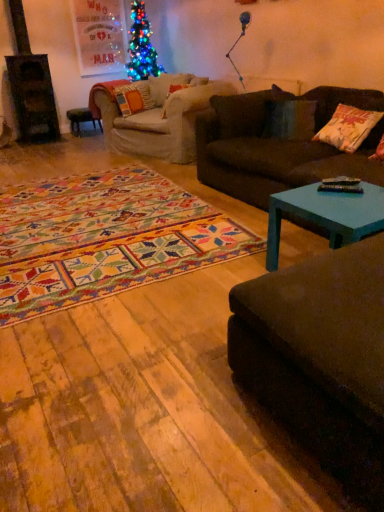
What is the approximate width of white cotton pillow at right, which is the first pillow from right to left?

It is 25.94 centimeters.

At what (x,y) coordinates should I click in order to perform the action: click on velvet orange pillow at center, positioned as the first pillow in back-to-front order. Please return your answer as a coordinate pair (x, y). The height and width of the screenshot is (512, 384). Looking at the image, I should click on (133, 98).

Is dark brown fabric couch at center, the second studio couch in the front-to-back sequence, completely or partially outside of velvet orange pillow at center, which ranks as the first pillow in left-to-right order?

dark brown fabric couch at center, the second studio couch in the front-to-back sequence, lies outside velvet orange pillow at center, which ranks as the first pillow in left-to-right order,'s area.

Which object is thinner, dark brown fabric couch at center, the second studio couch in the front-to-back sequence, or velvet orange pillow at center, positioned as the first pillow in back-to-front order?

Thinner between the two is velvet orange pillow at center, positioned as the first pillow in back-to-front order.

Which of these two, dark brown fabric couch at center, the second studio couch in the front-to-back sequence, or velvet orange pillow at center, which is the first pillow in top-to-bottom order, stands shorter?

velvet orange pillow at center, which is the first pillow in top-to-bottom order.

From the picture: Considering the relative positions of velvet orange pillow at center, which ranks as the first pillow in left-to-right order, and teal painted wood coffee table at lower right in the image provided, is velvet orange pillow at center, which ranks as the first pillow in left-to-right order, to the right of teal painted wood coffee table at lower right from the viewer's perspective?

Incorrect, velvet orange pillow at center, which ranks as the first pillow in left-to-right order, is not on the right side of teal painted wood coffee table at lower right.

Does point (141, 106) lie behind point (269, 197)?

Yes.

Is teal painted wood coffee table at lower right inside velvet orange pillow at center, which appears as the second pillow when viewed from the right?

No, teal painted wood coffee table at lower right is not inside velvet orange pillow at center, which appears as the second pillow when viewed from the right.

From a real-world perspective, is teal painted wood coffee table at lower right physically above matte black stool at left?

Yes.

Where is `coffee table above the matte black stool at left (from a real-world perspective)`? The height and width of the screenshot is (512, 384). coffee table above the matte black stool at left (from a real-world perspective) is located at coordinates (326, 215).

Is teal painted wood coffee table at lower right wider than matte black stool at left?

Indeed, teal painted wood coffee table at lower right has a greater width compared to matte black stool at left.

Is teal painted wood coffee table at lower right not inside matte black stool at left?

Yes, teal painted wood coffee table at lower right is not within matte black stool at left.

Considering the sizes of objects velvet orange pillow at center, which ranks as the first pillow in left-to-right order, and velvet dark brown couch at lower right, the 2th studio couch in the top-to-bottom sequence, in the image provided, who is shorter, velvet orange pillow at center, which ranks as the first pillow in left-to-right order, or velvet dark brown couch at lower right, the 2th studio couch in the top-to-bottom sequence,?

velvet dark brown couch at lower right, the 2th studio couch in the top-to-bottom sequence, is shorter.

From a real-world perspective, is velvet orange pillow at center, positioned as the first pillow in back-to-front order, on top of velvet dark brown couch at lower right, the 2th studio couch when ordered from back to front?

Yes.

Measure the distance from velvet orange pillow at center, which ranks as the first pillow in left-to-right order, to velvet dark brown couch at lower right, placed as the 1th studio couch when sorted from bottom to top.

velvet orange pillow at center, which ranks as the first pillow in left-to-right order, is 4.34 meters from velvet dark brown couch at lower right, placed as the 1th studio couch when sorted from bottom to top.

I want to click on studio couch that is the 2nd one when counting downward from the velvet orange pillow at center, which is the first pillow in top-to-bottom order (from the image's perspective), so [320, 357].

Is teal painted wood coffee table at lower right beside velvet orange pillow at center, which is the first pillow in top-to-bottom order?

teal painted wood coffee table at lower right is not next to velvet orange pillow at center, which is the first pillow in top-to-bottom order, and they're not touching.

Based on their positions, is teal painted wood coffee table at lower right located to the left or right of velvet orange pillow at center, which ranks as the first pillow in left-to-right order?

Clearly, teal painted wood coffee table at lower right is on the right of velvet orange pillow at center, which ranks as the first pillow in left-to-right order, in the image.

From a real-world perspective, which is physically below, teal painted wood coffee table at lower right or velvet orange pillow at center, positioned as the first pillow in back-to-front order?

In real-world perspective, teal painted wood coffee table at lower right is lower.

Which point is more forward, (317,183) or (129,88)?

Positioned in front is point (317,183).

Is point (145, 92) positioned in front of point (378, 184)?

No.

Considering the relative positions of velvet orange pillow at center, the 2th pillow viewed from the front, and dark brown fabric couch at center, the second studio couch in the front-to-back sequence, in the image provided, is velvet orange pillow at center, the 2th pillow viewed from the front, to the left of dark brown fabric couch at center, the second studio couch in the front-to-back sequence, from the viewer's perspective?

Correct, you'll find velvet orange pillow at center, the 2th pillow viewed from the front, to the left of dark brown fabric couch at center, the second studio couch in the front-to-back sequence.

Would you say velvet orange pillow at center, the 2th pillow ordered from the bottom, is outside dark brown fabric couch at center, which is the first studio couch from back to front?

velvet orange pillow at center, the 2th pillow ordered from the bottom, lies outside dark brown fabric couch at center, which is the first studio couch from back to front,'s area.

Could you tell me if teal painted wood coffee table at lower right is turned towards velvet dark brown couch at lower right, the 2th studio couch when ordered from back to front?

No, teal painted wood coffee table at lower right is not facing towards velvet dark brown couch at lower right, the 2th studio couch when ordered from back to front.

Where is `studio couch that is in front of the teal painted wood coffee table at lower right`? studio couch that is in front of the teal painted wood coffee table at lower right is located at coordinates (320, 357).

Is teal painted wood coffee table at lower right positioned behind velvet dark brown couch at lower right, arranged as the 1th studio couch when viewed from the front?

Yes, teal painted wood coffee table at lower right is behind velvet dark brown couch at lower right, arranged as the 1th studio couch when viewed from the front.

Which is in front, point (276, 226) or point (319, 452)?

The point (319, 452) is in front.

There is a dark brown fabric couch at center, the 1th studio couch from the top. At what (x,y) coordinates should I click in order to perform the action: click on the 1st pillow above it (from a real-world perspective). Please return your answer as a coordinate pair (x, y). The width and height of the screenshot is (384, 512). Looking at the image, I should click on (133, 98).

Where is `coffee table located underneath the velvet orange pillow at center, the 2th pillow viewed from the front (from a real-world perspective)`? coffee table located underneath the velvet orange pillow at center, the 2th pillow viewed from the front (from a real-world perspective) is located at coordinates (326, 215).

Considering their positions, is dark brown fabric couch at center, the second studio couch in the bottom-to-top sequence, positioned closer to teal painted wood coffee table at lower right than velvet orange pillow at center, which appears as the second pillow when viewed from the right?

dark brown fabric couch at center, the second studio couch in the bottom-to-top sequence, is positioned closer to the anchor teal painted wood coffee table at lower right.

When comparing their distances from white cotton pillow at right, which is the first pillow from right to left, does dark brown fabric couch at center, which is the first studio couch from back to front, or teal painted wood coffee table at lower right seem further?

Among the two, teal painted wood coffee table at lower right is located further to white cotton pillow at right, which is the first pillow from right to left.

Estimate the real-world distances between objects in this image. Which object is closer to velvet dark brown couch at lower right, placed as the 1th studio couch when sorted from bottom to top, velvet orange pillow at center, the 2th pillow ordered from the bottom, or dark brown fabric couch at center, the 1th studio couch from the top?

Among the two, dark brown fabric couch at center, the 1th studio couch from the top, is located nearer to velvet dark brown couch at lower right, placed as the 1th studio couch when sorted from bottom to top.

Considering their positions, is dark brown fabric couch at center, the second studio couch in the bottom-to-top sequence, positioned closer to matte black stool at left than velvet orange pillow at center, which ranks as the first pillow in left-to-right order?

velvet orange pillow at center, which ranks as the first pillow in left-to-right order, is closer to matte black stool at left.

Looking at the image, which one is located further to velvet dark brown couch at lower right, the 2th studio couch when ordered from back to front, velvet orange pillow at center, the 2th pillow viewed from the front, or teal painted wood coffee table at lower right?

velvet orange pillow at center, the 2th pillow viewed from the front.

When comparing their distances from velvet dark brown couch at lower right, placed as the 1th studio couch when sorted from bottom to top, does velvet orange pillow at center, which appears as the second pillow when viewed from the right, or white cotton pillow at right, which is counted as the second pillow, starting from the left, seem closer?

white cotton pillow at right, which is counted as the second pillow, starting from the left.

Looking at this image, considering their positions, is velvet orange pillow at center, the 2th pillow viewed from the front, positioned closer to velvet dark brown couch at lower right, the 2th studio couch in the top-to-bottom sequence, than matte black stool at left?

velvet orange pillow at center, the 2th pillow viewed from the front, is closer to velvet dark brown couch at lower right, the 2th studio couch in the top-to-bottom sequence.

Looking at the image, which one is located closer to white cotton pillow at right, which is counted as the second pillow, starting from the left, matte black stool at left or dark brown fabric couch at center, which is the first studio couch from back to front?

dark brown fabric couch at center, which is the first studio couch from back to front, is positioned closer to the anchor white cotton pillow at right, which is counted as the second pillow, starting from the left.

Identify the location of pillow located between dark brown fabric couch at center, the second studio couch in the bottom-to-top sequence, and velvet orange pillow at center, the 2th pillow ordered from the bottom, in the depth direction. (348, 128).

Locate an element on the screen. Image resolution: width=384 pixels, height=512 pixels. studio couch positioned between velvet dark brown couch at lower right, the 2th studio couch in the top-to-bottom sequence, and white cotton pillow at right, which is the first pillow from right to left, from near to far is located at coordinates (278, 144).

The image size is (384, 512). I want to click on studio couch located between velvet dark brown couch at lower right, arranged as the 1th studio couch when viewed from the front, and matte black stool at left in the depth direction, so click(x=278, y=144).

You are a GUI agent. You are given a task and a screenshot of the screen. Output one action in this format:
    pyautogui.click(x=<x>, y=<y>)
    Task: Click on the coffee table between velvet dark brown couch at lower right, the 2th studio couch in the top-to-bottom sequence, and matte black stool at left, along the z-axis
    
    Given the screenshot: What is the action you would take?
    pyautogui.click(x=326, y=215)